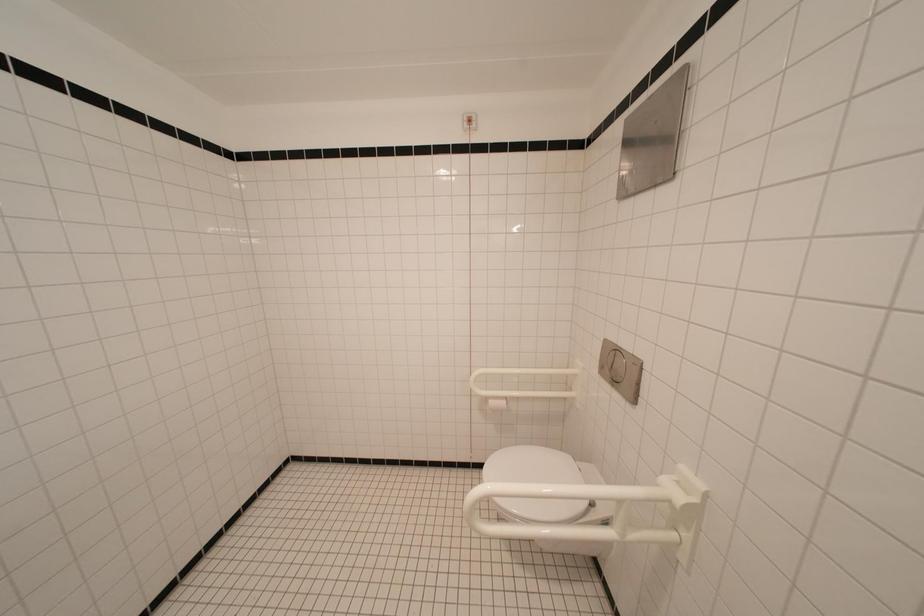
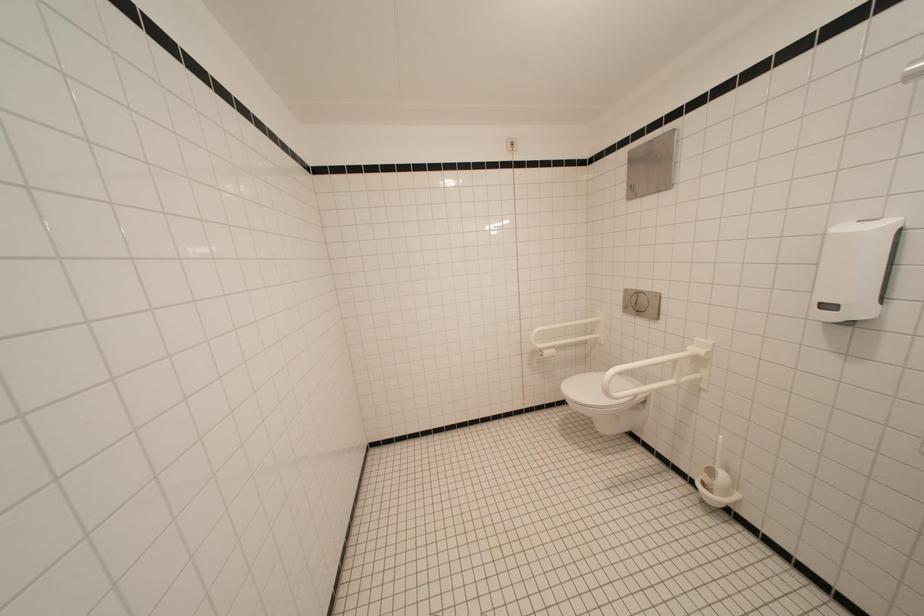
Question: The camera is either moving clockwise (left) or counter-clockwise (right) around the object. The first image is from the beginning of the video and the second image is from the end. Is the camera moving left or right when shooting the video?

Choices:
 (A) Left
 (B) Right

Answer: (A)